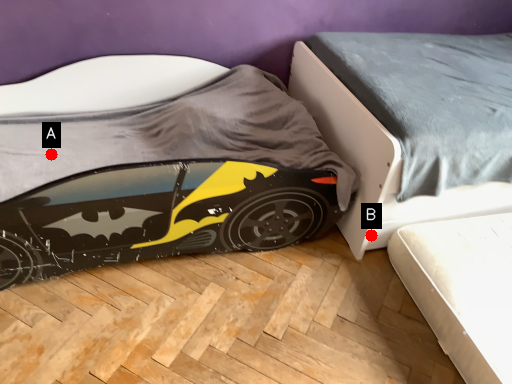
Question: Two points are circled on the image, labeled by A and B beside each circle. Among these points, which one is farthest from the camera?

Choices:
 (A) A is further
 (B) B is further

Answer: (A)